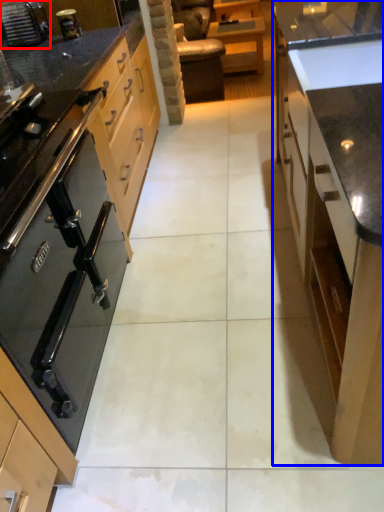
Question: Which object appears closest to the camera in this image, home appliance (highlighted by a red box) or cabinetry (highlighted by a blue box)?

Choices:
 (A) home appliance
 (B) cabinetry

Answer: (B)